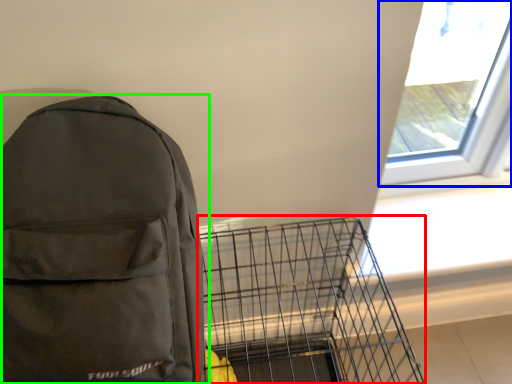
Question: Estimate the real-world distances between objects in this image. Which object is farther from bird cage (highlighted by a red box), window (highlighted by a blue box) or backpack (highlighted by a green box)?

Choices:
 (A) window
 (B) backpack

Answer: (A)